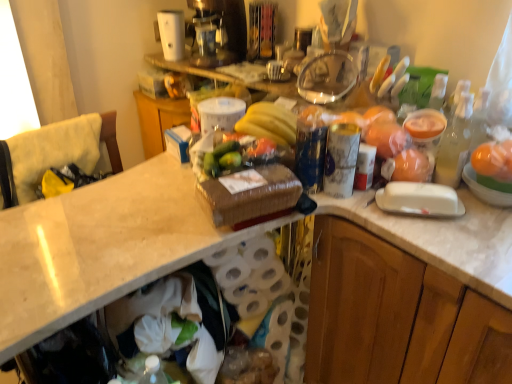
What is the approximate width of wooden cabinet at right?

wooden cabinet at right is 22.20 inches in width.

I want to click on translucent glass bottle at right, so click(455, 143).

The height and width of the screenshot is (384, 512). In order to click on yellow fabric cushion at left in this screenshot , I will do `click(54, 153)`.

This screenshot has height=384, width=512. In order to click on wooden cabinet at right in this screenshot , I will do `click(396, 317)`.

Is white plastic coffee maker at upper center placed right next to yellow matte bananas at center?

white plastic coffee maker at upper center and yellow matte bananas at center are not in contact.

From the image's perspective, between white plastic coffee maker at upper center and yellow matte bananas at center, who is located below?

From the image's view, yellow matte bananas at center is below.

Is point (173, 42) less distant than point (260, 112)?

No, it is not.

From a real-world perspective, relative to translucent glass bottle at right, is orange matte plastic oranges at upper right vertically above or below?

orange matte plastic oranges at upper right is above translucent glass bottle at right.

Does orange matte plastic oranges at upper right turn towards translucent glass bottle at right?

No.

Consider the image. Would you say translucent glass bottle at right is part of orange matte plastic oranges at upper right's contents?

No, orange matte plastic oranges at upper right does not contain translucent glass bottle at right.

Is orange matte plastic oranges at upper right beside translucent glass bottle at right?

They are not placed beside each other.

Relative to orange matte plastic oranges at upper right, is yellow matte bananas at center in front or behind?

yellow matte bananas at center is in front of orange matte plastic oranges at upper right.

From a real-world perspective, which is physically below, yellow matte bananas at center or orange matte plastic oranges at upper right?

orange matte plastic oranges at upper right is physically lower.

From the image's perspective, between yellow matte bananas at center and orange matte plastic oranges at upper right, which one is located above?

yellow matte bananas at center.

Is yellow matte bananas at center at the left side of white plastic coffee maker at upper center?

No, yellow matte bananas at center is not to the left of white plastic coffee maker at upper center.

From a real-world perspective, is yellow matte bananas at center under white plastic coffee maker at upper center?

Correct, in the physical world, yellow matte bananas at center is lower than white plastic coffee maker at upper center.

Which is in front, point (257, 118) or point (183, 42)?

Point (257, 118)

Do you think yellow matte bananas at center is within white plastic coffee maker at upper center, or outside of it?

yellow matte bananas at center is not inside white plastic coffee maker at upper center, it's outside.

Consider the image. From the image's perspective, between translucent glass bottle at right and yellow matte bananas at center, who is located below?

translucent glass bottle at right appears lower in the image.

Considering the sizes of objects translucent glass bottle at right and yellow matte bananas at center in the image provided, who is wider, translucent glass bottle at right or yellow matte bananas at center?

Wider between the two is yellow matte bananas at center.

Who is taller, translucent glass bottle at right or yellow matte bananas at center?

Standing taller between the two is translucent glass bottle at right.

Is translucent glass bottle at right facing away from yellow matte bananas at center?

That's not correct — translucent glass bottle at right is not looking away from yellow matte bananas at center.

Is yellow matte bananas at center aimed at wooden cabinet at right?

No, yellow matte bananas at center is not oriented towards wooden cabinet at right.

Identify the location of banana above the wooden cabinet at right (from the image's perspective). This screenshot has width=512, height=384. (269, 123).

Measure the distance between yellow matte bananas at center and wooden cabinet at right.

A distance of 19.09 inches exists between yellow matte bananas at center and wooden cabinet at right.

Which object is closer to the camera taking this photo, yellow matte bananas at center or wooden cabinet at right?

wooden cabinet at right is closer to the camera.

Measure the distance between orange matte plastic oranges at upper right and yellow matte bananas at center.

orange matte plastic oranges at upper right and yellow matte bananas at center are 10.02 inches apart from each other.

Considering the relative sizes of orange matte plastic oranges at upper right and yellow matte bananas at center in the image provided, is orange matte plastic oranges at upper right wider than yellow matte bananas at center?

Incorrect, the width of orange matte plastic oranges at upper right does not surpass that of yellow matte bananas at center.

Is yellow matte bananas at center completely or partially inside orange matte plastic oranges at upper right?

No, yellow matte bananas at center is not inside orange matte plastic oranges at upper right.

Is orange matte plastic oranges at upper right aimed at yellow matte bananas at center?

No, orange matte plastic oranges at upper right is not aimed at yellow matte bananas at center.

The image size is (512, 384). I want to click on appliance on the left of yellow matte bananas at center, so click(172, 33).

This screenshot has width=512, height=384. I want to click on bottle on the right of the orange matte plastic oranges at upper right, so click(455, 143).

Based on the photo, when comparing their distances from yellow fabric cushion at left, does white plastic coffee maker at upper center or yellow matte bananas at center seem further?

white plastic coffee maker at upper center is positioned further to the anchor yellow fabric cushion at left.

Based on their spatial positions, is translucent glass bottle at right or white plastic coffee maker at upper center closer to wooden cabinet at right?

The object closer to wooden cabinet at right is translucent glass bottle at right.

From the image, which object appears to be farther from yellow fabric cushion at left, orange matte plastic oranges at upper right or white plastic coffee maker at upper center?

Among the two, orange matte plastic oranges at upper right is located further to yellow fabric cushion at left.

From the image, which object appears to be nearer to wooden cabinet at right, yellow fabric cushion at left or translucent glass bottle at right?

Based on the image, translucent glass bottle at right appears to be nearer to wooden cabinet at right.

Estimate the real-world distances between objects in this image. Which object is further from translucent glass bottle at right, wooden cabinet at right or yellow fabric cushion at left?

Among the two, yellow fabric cushion at left is located further to translucent glass bottle at right.

Based on their spatial positions, is wooden cabinet at right or white plastic coffee maker at upper center closer to translucent glass bottle at right?

wooden cabinet at right.

When comparing their distances from white plastic coffee maker at upper center, does yellow matte bananas at center or wooden cabinet at right seem further?

wooden cabinet at right lies further to white plastic coffee maker at upper center than the other object.

Based on their spatial positions, is orange matte plastic oranges at upper right or wooden cabinet at right further from yellow matte bananas at center?

Based on the image, wooden cabinet at right appears to be further to yellow matte bananas at center.

Where is `food between yellow fabric cushion at left and translucent glass bottle at right from left to right`? The height and width of the screenshot is (384, 512). food between yellow fabric cushion at left and translucent glass bottle at right from left to right is located at coordinates (386, 138).

Locate an element on the screen. food located between yellow fabric cushion at left and wooden cabinet at right in the left-right direction is located at coordinates (386, 138).

Where is `bottle that lies between white plastic coffee maker at upper center and wooden cabinet at right from top to bottom`? bottle that lies between white plastic coffee maker at upper center and wooden cabinet at right from top to bottom is located at coordinates (455, 143).

Where is `appliance located between yellow fabric cushion at left and wooden cabinet at right in the left-right direction`? The width and height of the screenshot is (512, 384). appliance located between yellow fabric cushion at left and wooden cabinet at right in the left-right direction is located at coordinates (172, 33).